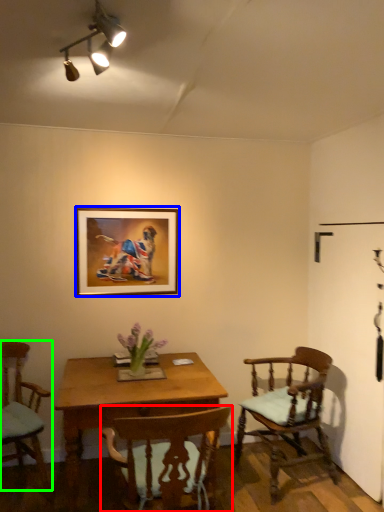
Question: Which is nearer to the chair (highlighted by a red box)? picture frame (highlighted by a blue box) or chair (highlighted by a green box).

Choices:
 (A) picture frame
 (B) chair

Answer: (B)